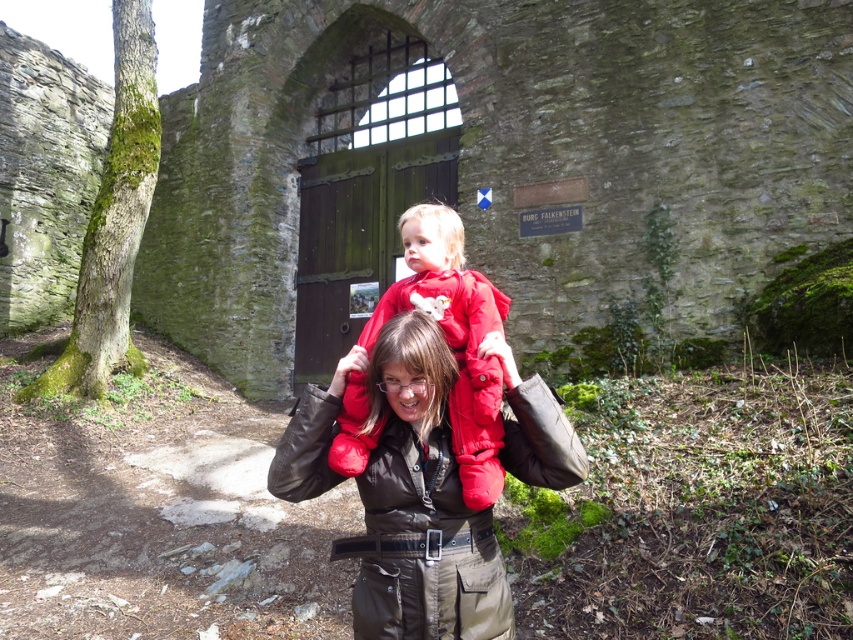
Question: Can you confirm if brown leather jacket at center is positioned below matte red jacket at center?

Choices:
 (A) no
 (B) yes

Answer: (B)

Question: Which of the following is the closest to the observer?

Choices:
 (A) (289, 465)
 (B) (477, 355)

Answer: (A)

Question: Which object is closer to the camera taking this photo?

Choices:
 (A) brown leather jacket at center
 (B) matte red jacket at center

Answer: (A)

Question: Is brown leather jacket at center to the left of matte red jacket at center from the viewer's perspective?

Choices:
 (A) yes
 (B) no

Answer: (A)

Question: Can you confirm if brown leather jacket at center is positioned to the right of matte red jacket at center?

Choices:
 (A) no
 (B) yes

Answer: (A)